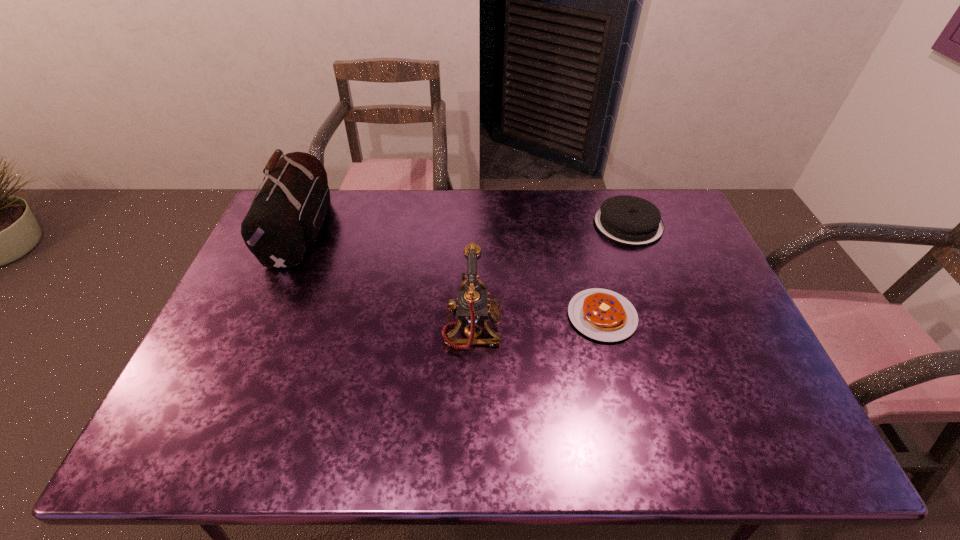
Find the location of a particular element. The width and height of the screenshot is (960, 540). vacant space located on the left of the shortest object is located at coordinates (454, 316).

Locate an element on the screen. The height and width of the screenshot is (540, 960). duffel bag located in the far edge section of the desktop is located at coordinates (285, 218).

I want to click on pancake that is at the far edge, so click(x=628, y=220).

This screenshot has width=960, height=540. I want to click on object that is at the left edge, so click(x=285, y=218).

Where is `object located at the right edge`? This screenshot has width=960, height=540. object located at the right edge is located at coordinates (628, 220).

Identify the location of object at the far left corner. (285, 218).

Identify the location of object positioned at the far right corner. (628, 220).

In the image, there is a desktop. Where is `vacant space at the far edge`? vacant space at the far edge is located at coordinates (484, 199).

Identify the location of free space at the near edge of the desktop. (299, 447).

The image size is (960, 540). In the image, there is a desktop. Find the location of `vacant space at the right edge`. vacant space at the right edge is located at coordinates (733, 336).